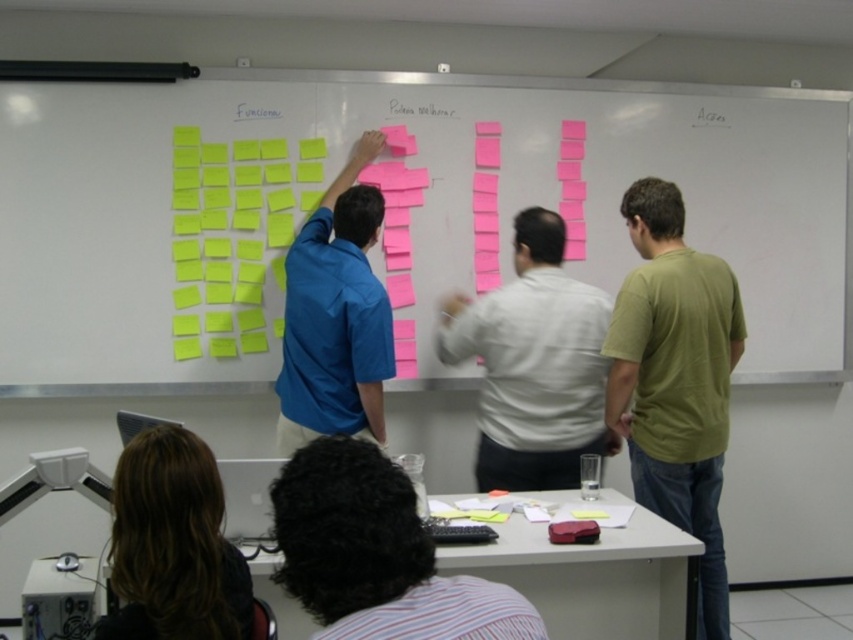
Is striped cotton shirt at lower center below white paper at upper center?

Yes.

How distant is striped cotton shirt at lower center from white paper at upper center?

striped cotton shirt at lower center is 2.48 meters away from white paper at upper center.

Between point (351, 472) and point (393, 113), which one is positioned in front?

Positioned in front is point (351, 472).

I want to click on striped cotton shirt at lower center, so point(376,554).

Can you confirm if striped cotton shirt at lower center is positioned below dark brown hair at lower left?

No, striped cotton shirt at lower center is not below dark brown hair at lower left.

Is point (347, 600) positioned in front of point (167, 544)?

Yes, it is.

Find the location of a particular element. The width and height of the screenshot is (853, 640). striped cotton shirt at lower center is located at coordinates (376, 554).

Consider the image. Does green matte t-shirt at right appear on the left side of dark brown hair at lower left?

No, green matte t-shirt at right is not to the left of dark brown hair at lower left.

Does point (607, 333) lie behind point (115, 496)?

That is True.

Based on the photo, measure the distance between green matte t-shirt at right and camera.

Result: The distance of green matte t-shirt at right from camera is 2.51 meters.

At what (x,y) coordinates should I click in order to perform the action: click on green matte t-shirt at right. Please return your answer as a coordinate pair (x, y). The width and height of the screenshot is (853, 640). Looking at the image, I should click on (675, 380).